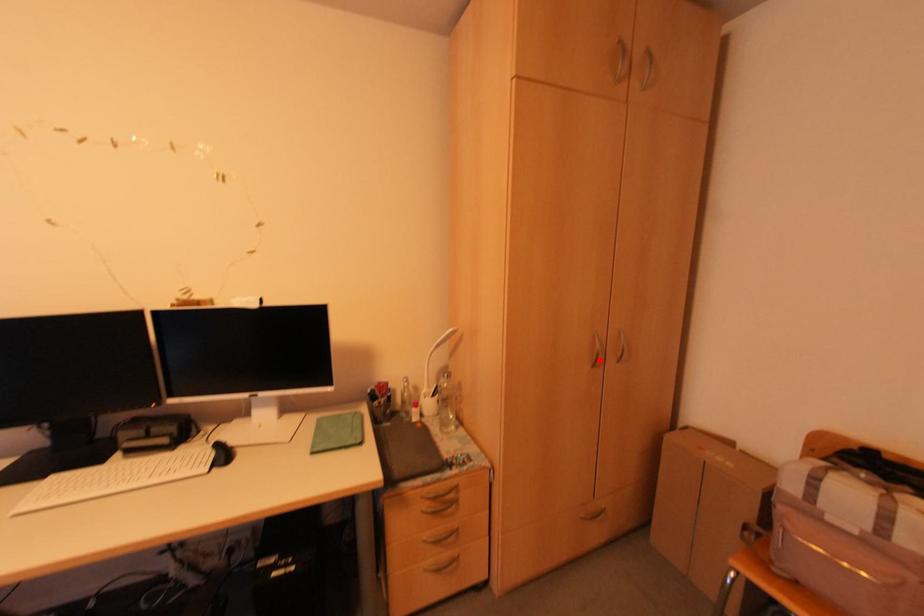
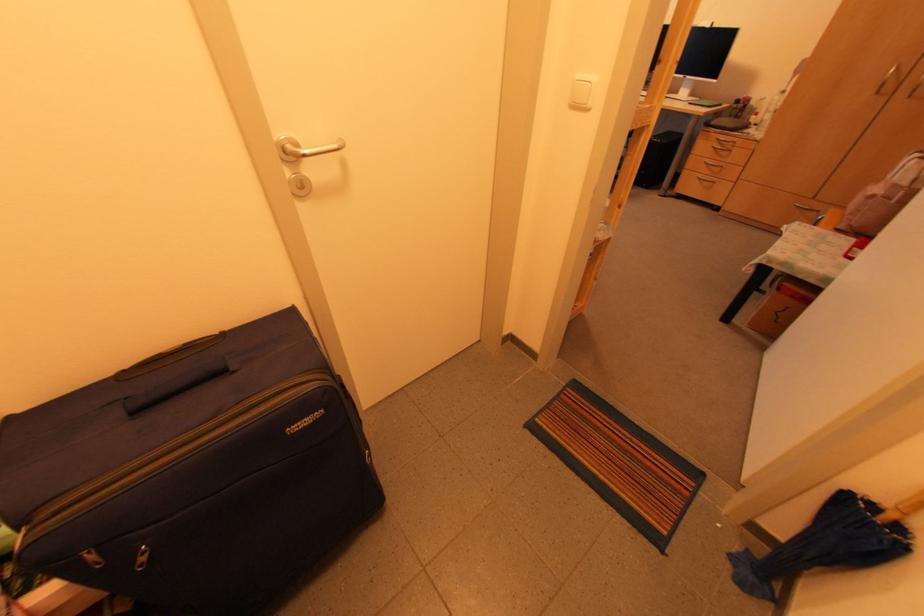
Question: I am providing you with two images of the same scene from different viewpoints. In image1, a red point is highlighted. Considering the same 3D point in image2, which of the following is correct?

Choices:
 (A) It is closer
 (B) It is farther

Answer: (B)